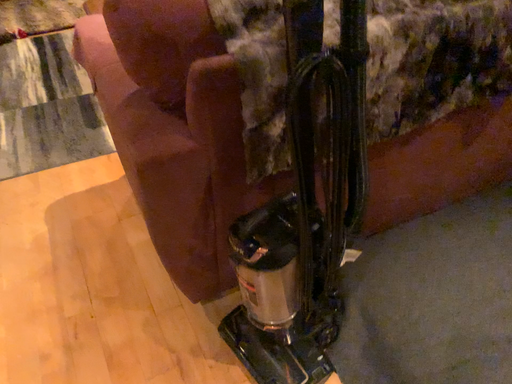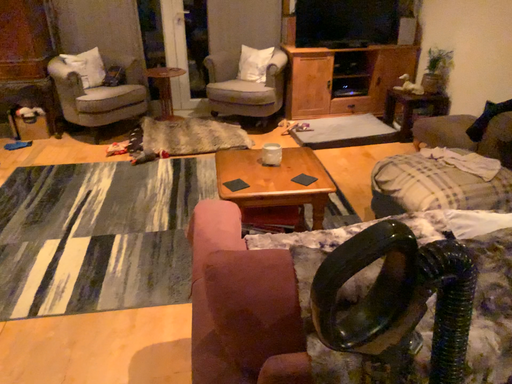
Question: Which way did the camera rotate in the video?

Choices:
 (A) rotated right
 (B) rotated left

Answer: (B)